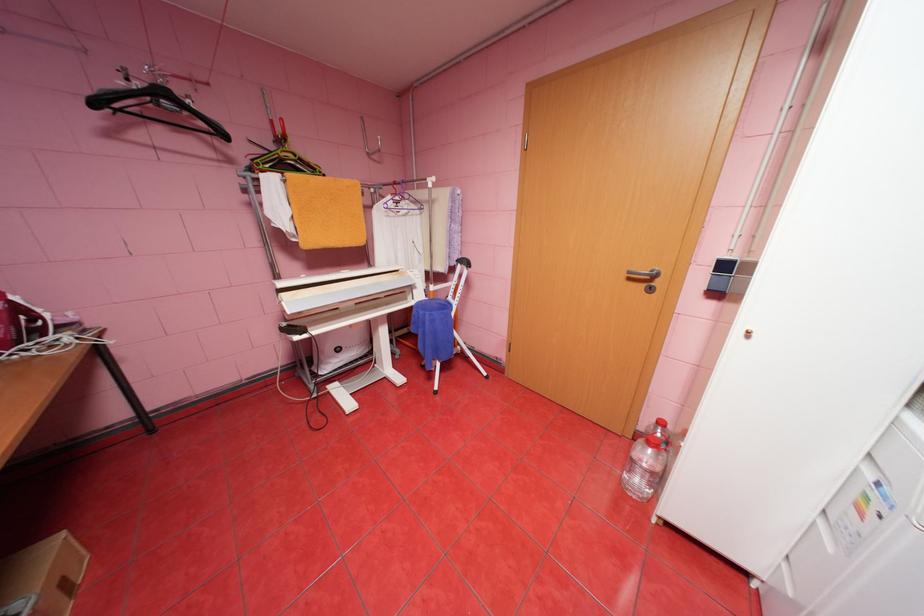
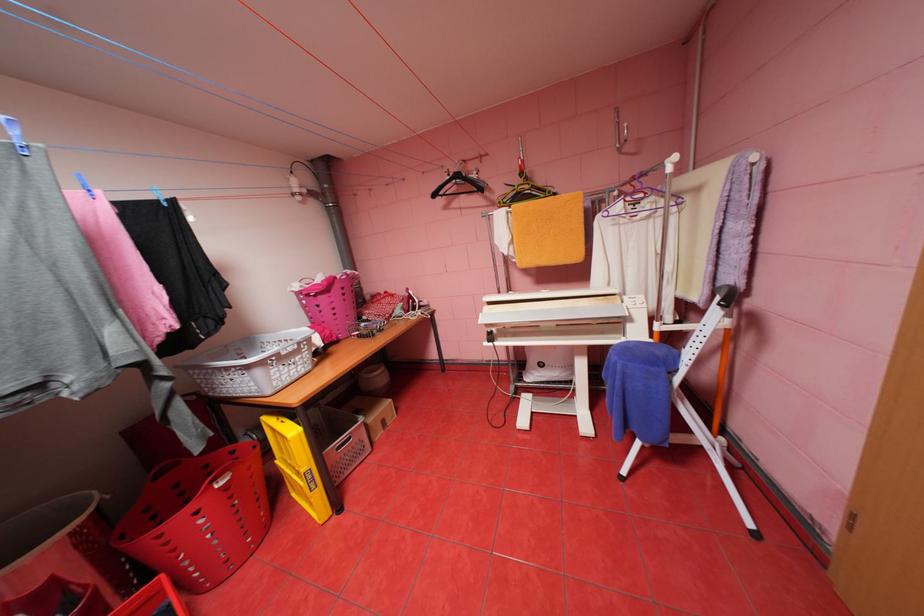
Question: The camera is either moving clockwise (left) or counter-clockwise (right) around the object. The first image is from the beginning of the video and the second image is from the end. Is the camera moving left or right when shooting the video?

Choices:
 (A) Left
 (B) Right

Answer: (B)